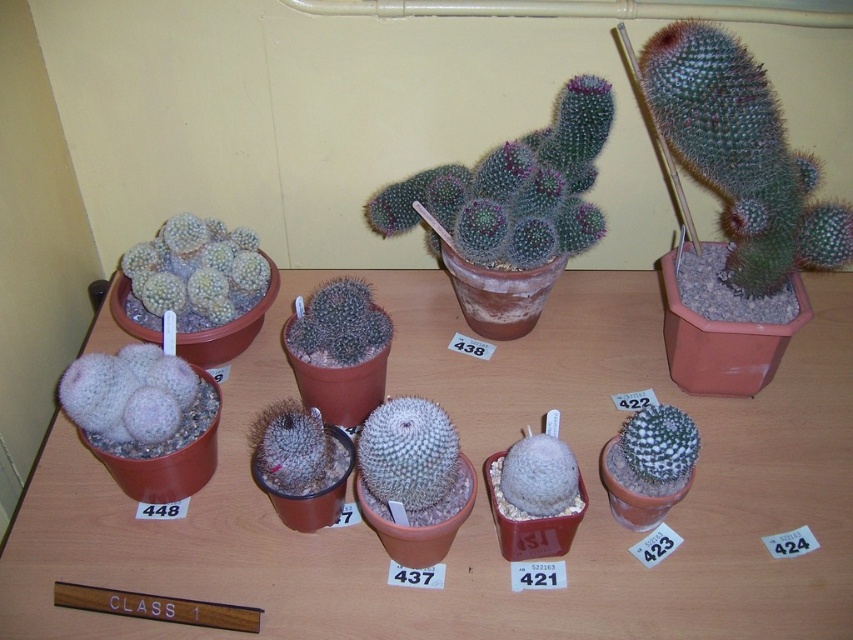
Question: Can you confirm if terracotta clay pots at center is positioned to the right of succulent cactus at center?

Choices:
 (A) no
 (B) yes

Answer: (B)

Question: Which point is farther to the camera?

Choices:
 (A) (186, 296)
 (B) (355, 333)
 (C) (578, 163)

Answer: (A)

Question: Can you confirm if green spiky cactus at upper right is wider than green spiky cactus at center?

Choices:
 (A) no
 (B) yes

Answer: (B)

Question: Estimate the real-world distances between objects in this image. Which object is closer to the green spiky cactus at upper right?

Choices:
 (A) white fuzzy cactus at upper left
 (B) terracotta clay pots at center

Answer: (B)

Question: From the image, what is the correct spatial relationship of green spiky cactus at center in relation to white fuzzy cactus at upper left?

Choices:
 (A) above
 (B) below

Answer: (A)

Question: Among these objects, which one is farthest from the camera?

Choices:
 (A) green spiky cactus at center
 (B) green spiky cactus at upper right
 (C) terracotta clay pots at center
 (D) succulent cactus at center

Answer: (A)